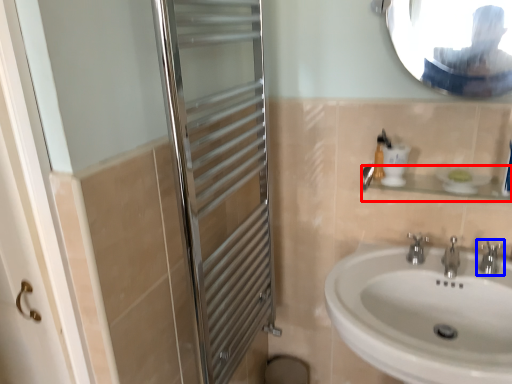
Question: Among these objects, which one is nearest to the camera, balustrade (highlighted by a red box) or tap (highlighted by a blue box)?

Choices:
 (A) balustrade
 (B) tap

Answer: (A)